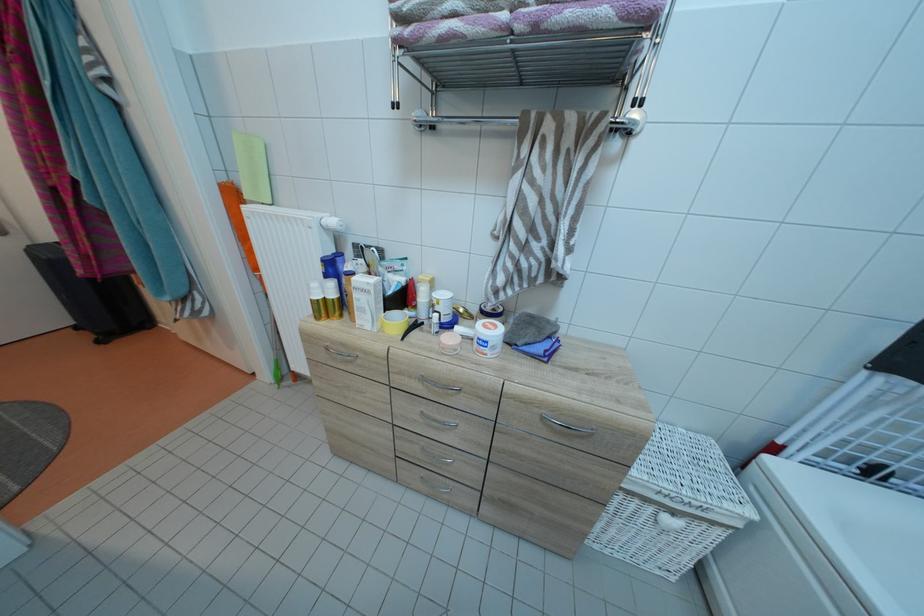
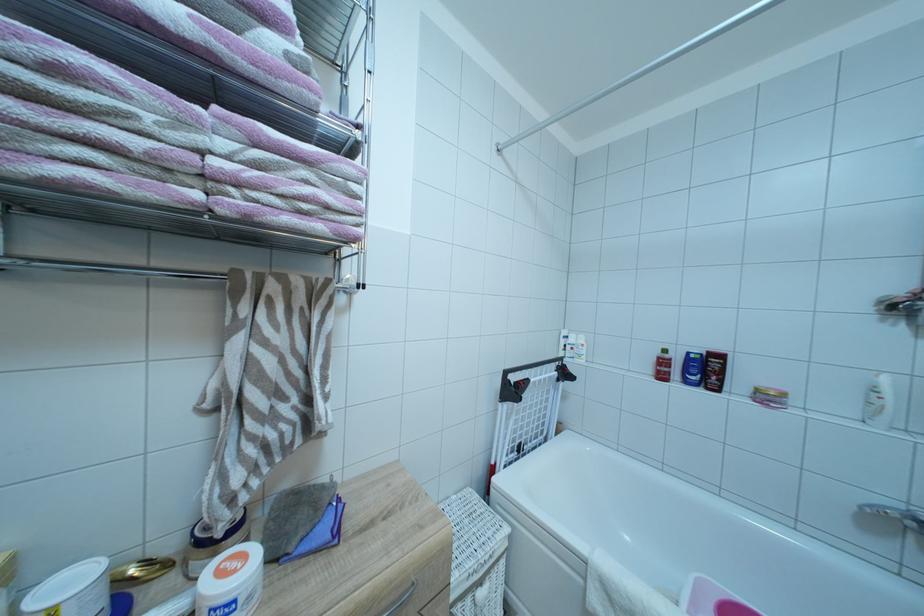
Question: The camera is either moving clockwise (left) or counter-clockwise (right) around the object. The first image is from the beginning of the video and the second image is from the end. Is the camera moving left or right when shooting the video?

Choices:
 (A) Left
 (B) Right

Answer: (A)